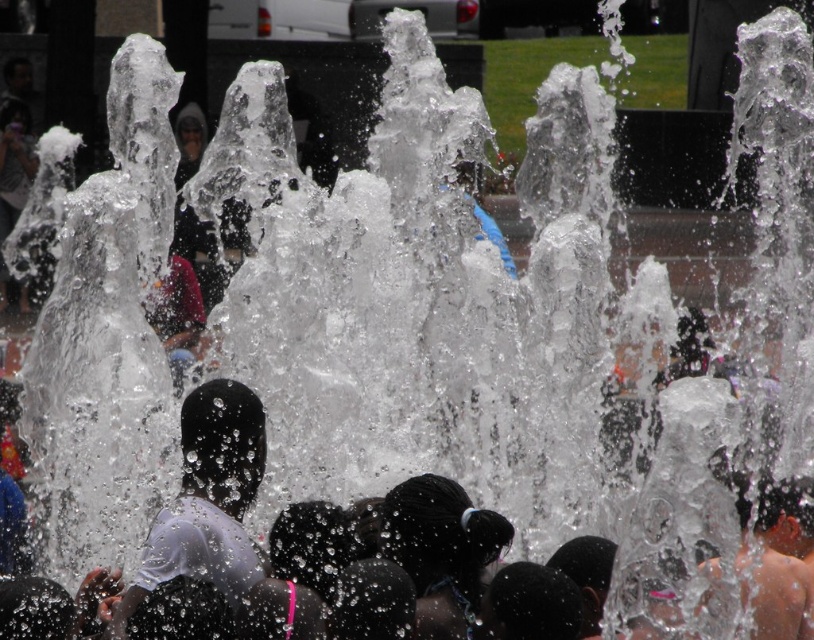
Question: Does transparent wet hair at center appear on the right side of white matte shirt at center?

Choices:
 (A) yes
 (B) no

Answer: (A)

Question: Is transparent wet hair at center positioned in front of white matte shirt at center?

Choices:
 (A) no
 (B) yes

Answer: (B)

Question: Which of the following is the closest to the observer?

Choices:
 (A) (204, 432)
 (B) (182, 440)

Answer: (A)

Question: Which point is farther from the camera taking this photo?

Choices:
 (A) (182, 534)
 (B) (206, 394)

Answer: (B)

Question: Does transparent wet hair at center appear under white matte shirt at center?

Choices:
 (A) yes
 (B) no

Answer: (A)